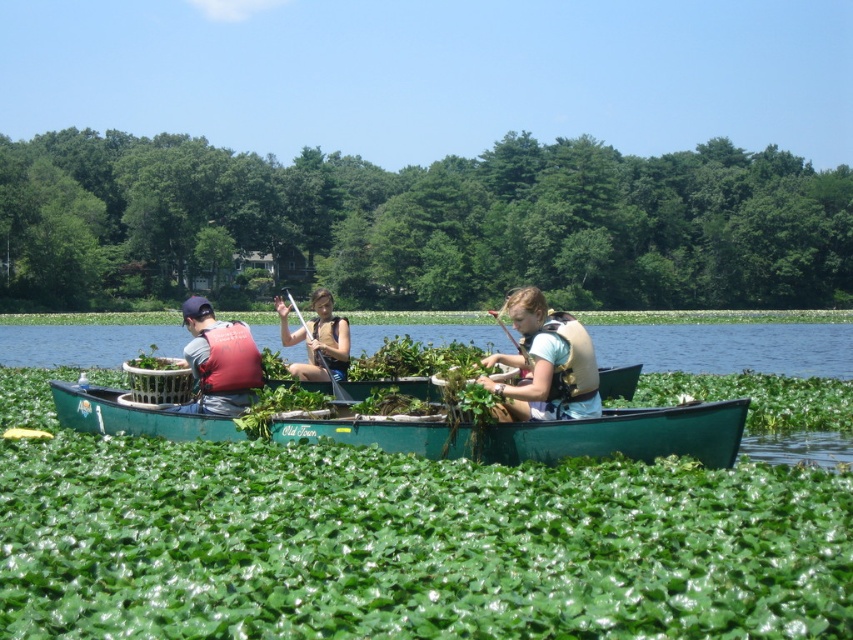
Question: Which of these objects is positioned farthest from the matte brown life vest at center?

Choices:
 (A) matte red life vest at left
 (B) light blue fabric shirt at center

Answer: (A)

Question: Based on their relative distances, which object is nearer to the light blue fabric shirt at center?

Choices:
 (A) matte red life vest at left
 (B) matte brown life vest at center
 (C) green plastic canoe at center

Answer: (A)

Question: Does green leafy plants at center appear under light blue fabric shirt at center?

Choices:
 (A) no
 (B) yes

Answer: (A)

Question: Which point is farther to the camera?

Choices:
 (A) green plastic canoe at center
 (B) green leafy plants at center
 (C) matte brown life vest at center
 (D) matte red life vest at left

Answer: (B)

Question: Does green leafy plants at center have a greater width compared to green plastic canoe at center?

Choices:
 (A) no
 (B) yes

Answer: (B)

Question: Is green leafy plants at center above green plastic canoe at center?

Choices:
 (A) no
 (B) yes

Answer: (B)